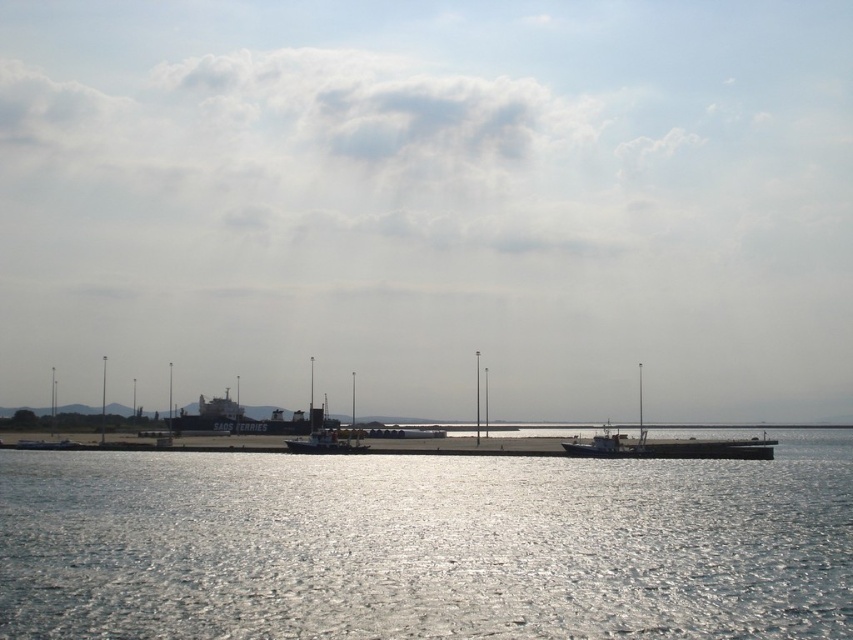
Question: Which object is farther from the camera taking this photo?

Choices:
 (A) metallic gray barge at center
 (B) metallic gray boat at center

Answer: (B)

Question: Can you confirm if glistening silver water at center is bigger than metallic gray barge at center?

Choices:
 (A) no
 (B) yes

Answer: (B)

Question: Does glistening silver water at center appear under metallic gray boat at center?

Choices:
 (A) no
 (B) yes

Answer: (A)

Question: Which of the following is the farthest from the observer?

Choices:
 (A) (259, 618)
 (B) (769, 456)
 (C) (689, 448)

Answer: (C)

Question: Is the position of metallic gray boat at center less distant than that of metallic gray barge at center?

Choices:
 (A) yes
 (B) no

Answer: (B)

Question: Which of these objects is positioned closest to the metallic gray barge at center?

Choices:
 (A) glistening silver water at center
 (B) metallic gray boat at center

Answer: (B)